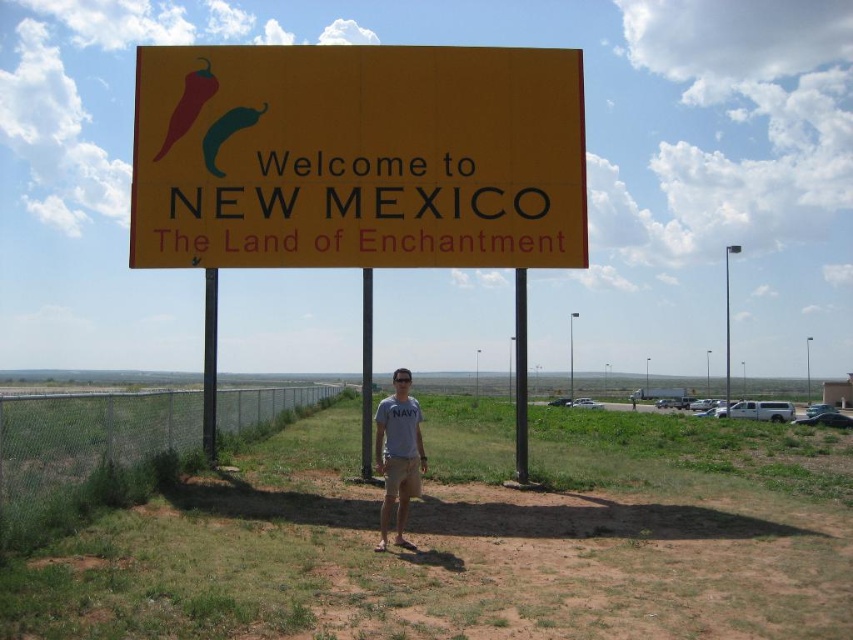
You are standing at point (398, 456) in the image. What object is located at this point?

The gray cotton shirt at center is located at point (398, 456).

Looking at this image, you are a photographer trying to capture both the yellow matte sign at upper center and the gray cotton shirt at center in a single frame. Given that your camera has a maximum focus range of 14 feet, will you be able to achieve this?

The yellow matte sign at upper center and gray cotton shirt at center are 14.12 feet apart. Since the camera can only focus up to 14 feet, the distance between them exceeds the maximum focus range. Therefore, you won